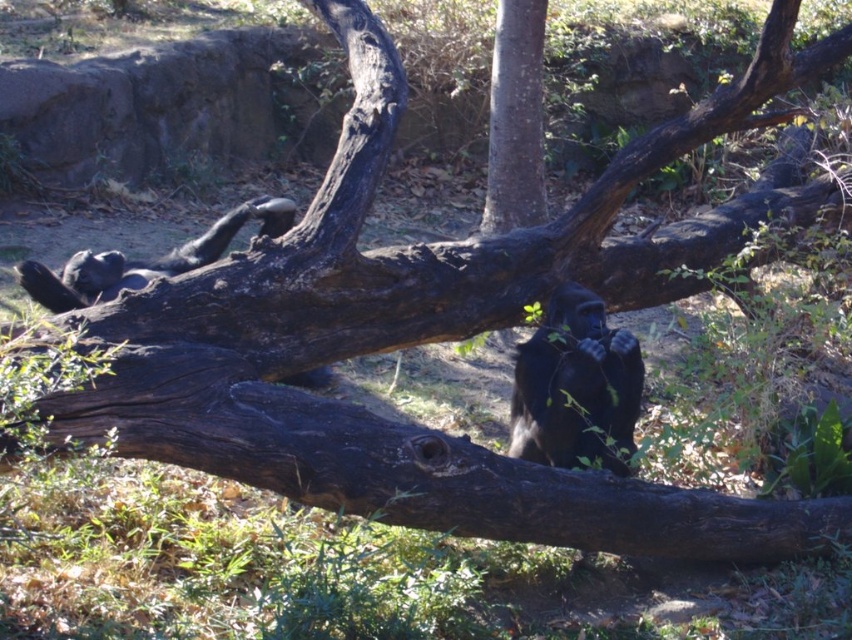
Question: Does shiny black ape at center have a lesser width compared to smooth brown tree trunk at center?

Choices:
 (A) no
 (B) yes

Answer: (A)

Question: Which of the following is the closest to the observer?

Choices:
 (A) smooth brown tree trunk at center
 (B) shiny black ape at center

Answer: (B)

Question: Is shiny black ape at center further to camera compared to smooth brown tree trunk at center?

Choices:
 (A) yes
 (B) no

Answer: (B)

Question: Which point is closer to the camera?

Choices:
 (A) smooth brown tree trunk at center
 (B) shiny black ape at center

Answer: (B)

Question: Is shiny black ape at center positioned at the back of smooth brown tree trunk at center?

Choices:
 (A) no
 (B) yes

Answer: (A)